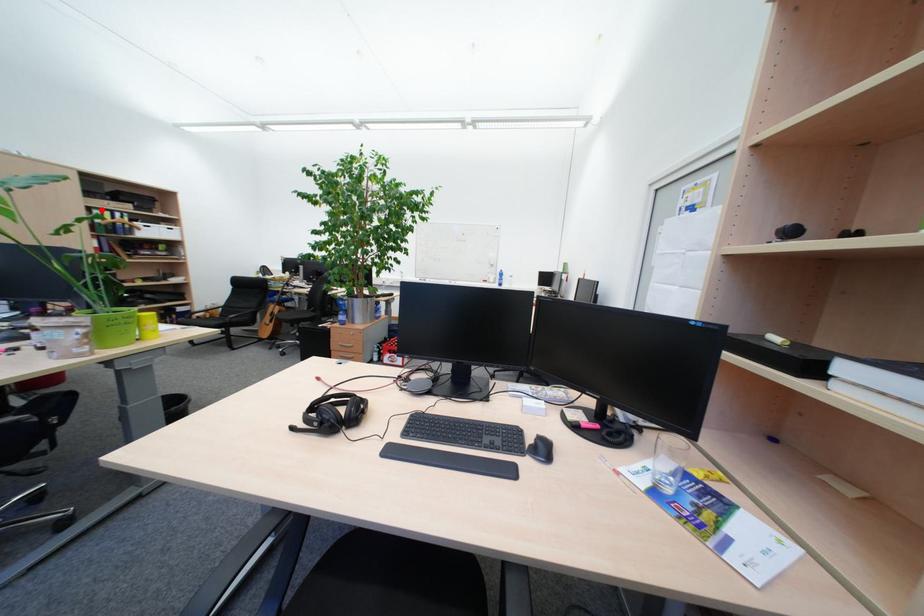
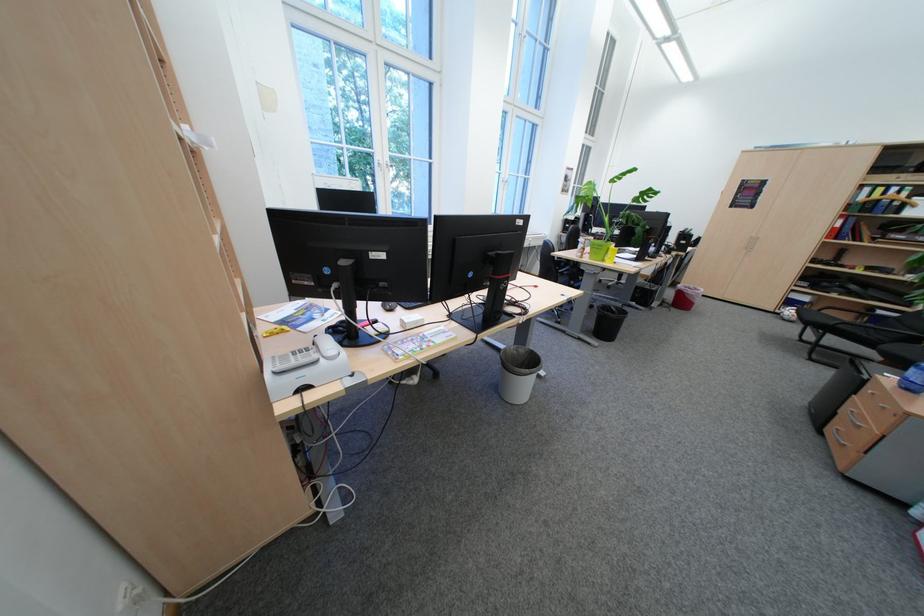
The point at the highlighted location is marked in the first image. Where is the corresponding point in the second image?

(873, 188)